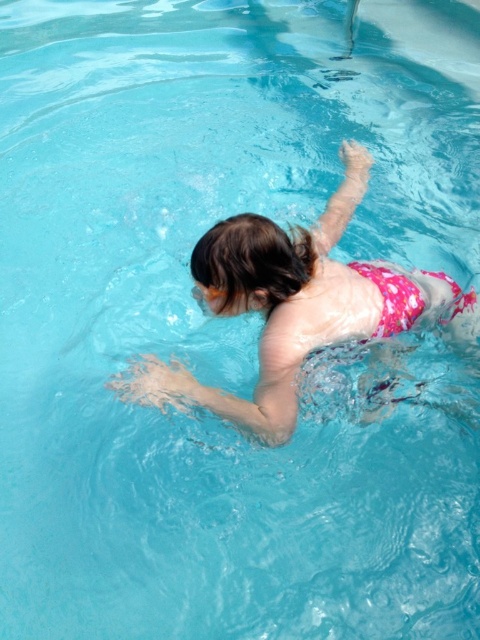
Question: Does pink floral swimsuit at center lie behind transparent plastic goggles at upper center?

Choices:
 (A) no
 (B) yes

Answer: (A)

Question: Which object is farther from the camera taking this photo?

Choices:
 (A) pink floral swimsuit at center
 (B) transparent plastic goggles at upper center

Answer: (B)

Question: Which of the following is the farthest from the observer?

Choices:
 (A) (405, 323)
 (B) (204, 285)

Answer: (A)

Question: From the image, what is the correct spatial relationship of pink floral swimsuit at center in relation to transparent plastic goggles at upper center?

Choices:
 (A) left
 (B) right

Answer: (B)

Question: Does pink floral swimsuit at center have a greater width compared to transparent plastic goggles at upper center?

Choices:
 (A) yes
 (B) no

Answer: (A)